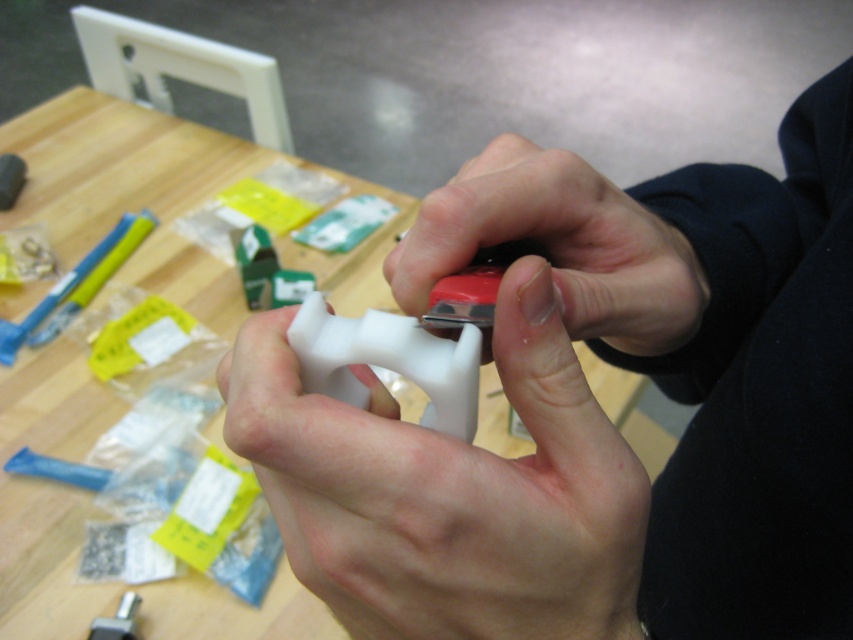
Question: Which object is positioned closest to the wooden table at center?

Choices:
 (A) white matte plastic object at center
 (B) white matte game controller at center
 (C) white matte plastic at center
 (D) matte black tool at center

Answer: (A)

Question: Does white matte plastic object at center appear on the left side of matte black tool at center?

Choices:
 (A) no
 (B) yes

Answer: (A)

Question: Which of the following is the closest to the observer?

Choices:
 (A) matte black tool at center
 (B) white matte plastic at center
 (C) wooden table at center
 (D) white matte plastic object at center

Answer: (D)

Question: Which point is farther from the camera taking this photo?

Choices:
 (A) tap(396, 465)
 (B) tap(352, 300)

Answer: (B)

Question: Observing the image, what is the correct spatial positioning of matte black tool at center in reference to white matte game controller at center?

Choices:
 (A) above
 (B) below

Answer: (A)

Question: Does white matte plastic object at center have a larger size compared to white matte plastic at center?

Choices:
 (A) no
 (B) yes

Answer: (B)